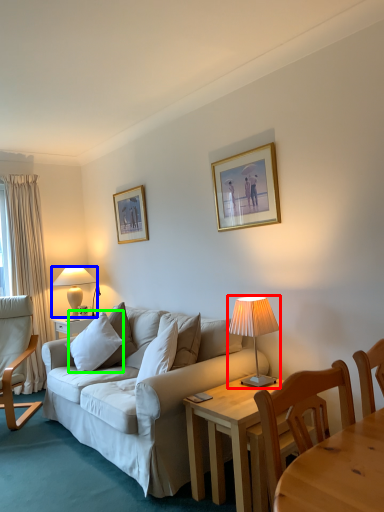
Question: Based on their relative distances, which object is farther from lamp (highlighted by a red box)? Choose from lamp (highlighted by a blue box) and pillow (highlighted by a green box).

Choices:
 (A) lamp
 (B) pillow

Answer: (A)